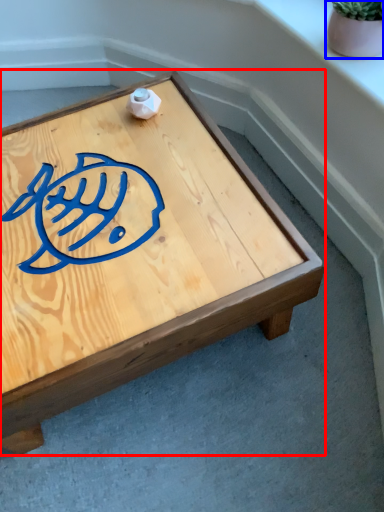
Question: Which point is closer to the camera, coffee table (highlighted by a red box) or flowerpot (highlighted by a blue box)?

Choices:
 (A) coffee table
 (B) flowerpot

Answer: (A)